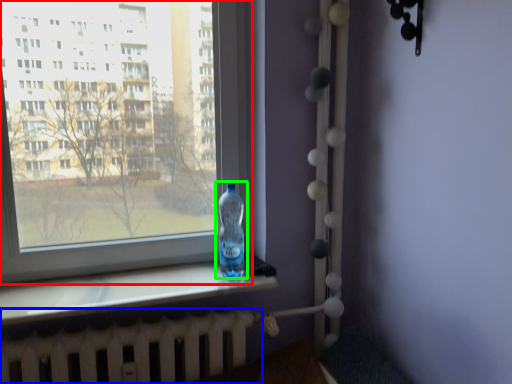
Question: Which is nearer to the window (highlighted by a red box)? radiator (highlighted by a blue box) or bottle (highlighted by a green box).

Choices:
 (A) radiator
 (B) bottle

Answer: (B)